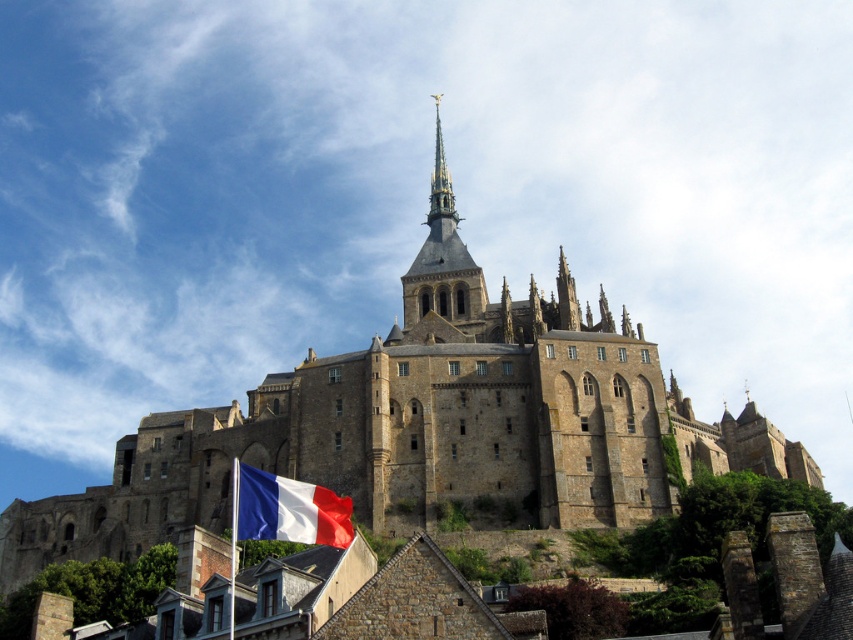
Question: Is golden stone spire at upper center positioned at the back of polyester french flag at lower left?

Choices:
 (A) no
 (B) yes

Answer: (B)

Question: Is golden stone spire at upper center to the right of polyester french flag at lower left from the viewer's perspective?

Choices:
 (A) no
 (B) yes

Answer: (B)

Question: Which of the following is the closest to the observer?

Choices:
 (A) (248, 467)
 (B) (421, 294)

Answer: (A)

Question: Is golden stone spire at upper center to the right of polyester french flag at lower left from the viewer's perspective?

Choices:
 (A) no
 (B) yes

Answer: (B)